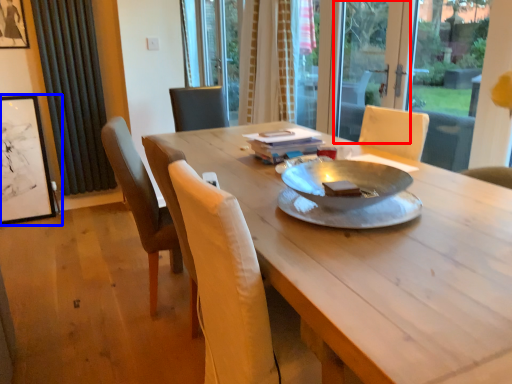
Question: Which object is further to the camera taking this photo, screen door (highlighted by a red box) or picture frame (highlighted by a blue box)?

Choices:
 (A) screen door
 (B) picture frame

Answer: (B)